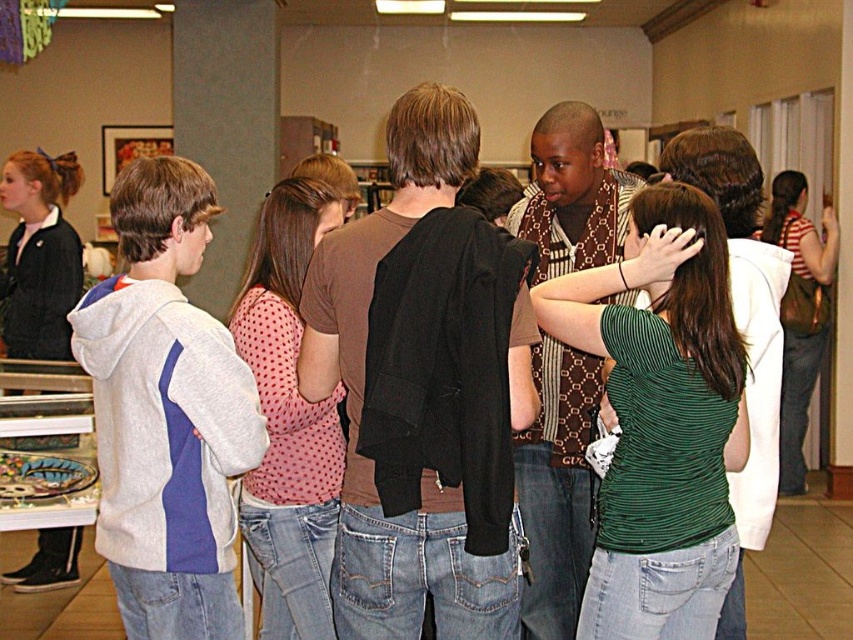
From the picture: Who is lower down, gray hoodie at left or green ribbed shirt at center?

green ribbed shirt at center is lower down.

In the scene shown: Is gray hoodie at left taller than green ribbed shirt at center?

Correct, gray hoodie at left is much taller as green ribbed shirt at center.

Describe the element at coordinates (166, 412) in the screenshot. I see `gray hoodie at left` at that location.

What are the coordinates of `gray hoodie at left` in the screenshot? It's located at (166, 412).